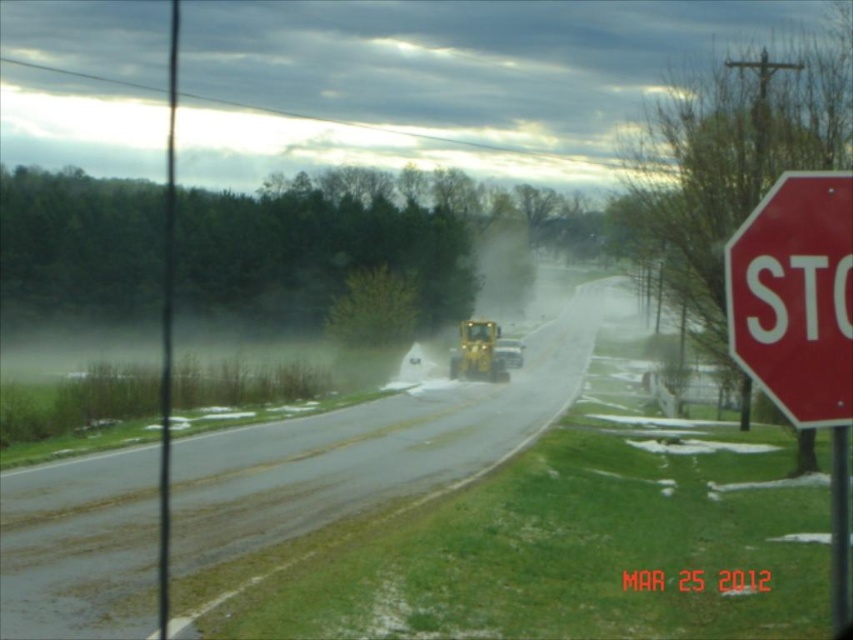
Can you confirm if red matte stop sign at right is thinner than yellow rubber tractor at center?

Correct, red matte stop sign at right's width is less than yellow rubber tractor at center's.

Can you confirm if red matte stop sign at right is positioned below yellow rubber tractor at center?

No, red matte stop sign at right is not below yellow rubber tractor at center.

Is point (788, 314) closer to viewer compared to point (515, 362)?

Yes, point (788, 314) is in front of point (515, 362).

Find the location of a particular element. red matte stop sign at right is located at coordinates (795, 296).